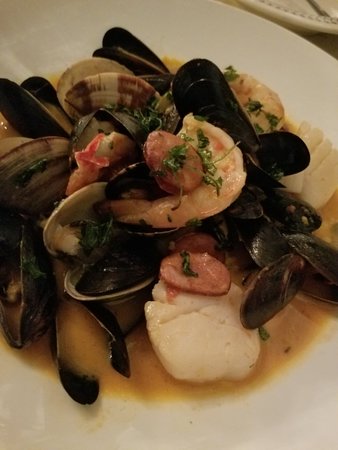
Where is `sauce at bottom of plate`? Image resolution: width=338 pixels, height=450 pixels. sauce at bottom of plate is located at coordinates (153, 378).